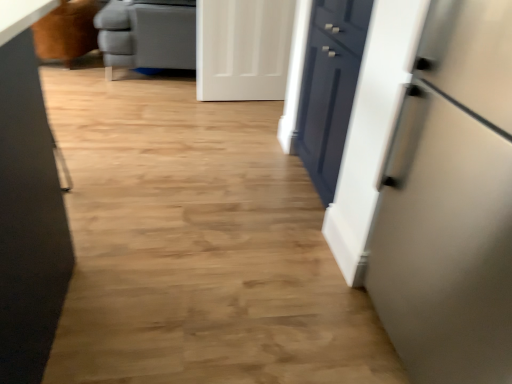
Question: Is satin white refrigerator at right wider than white matte door at upper center?

Choices:
 (A) no
 (B) yes

Answer: (B)

Question: Can we say satin white refrigerator at right lies outside white matte door at upper center?

Choices:
 (A) yes
 (B) no

Answer: (A)

Question: Are satin white refrigerator at right and white matte door at upper center beside each other?

Choices:
 (A) yes
 (B) no

Answer: (B)

Question: Does satin white refrigerator at right have a lesser height compared to white matte door at upper center?

Choices:
 (A) yes
 (B) no

Answer: (B)

Question: Would you say satin white refrigerator at right contains white matte door at upper center?

Choices:
 (A) no
 (B) yes

Answer: (A)

Question: From their relative heights in the image, would you say gray leather ottoman at upper left is taller or shorter than brown leather armchair at upper left?

Choices:
 (A) short
 (B) tall

Answer: (B)

Question: Looking at their shapes, would you say gray leather ottoman at upper left is wider or thinner than brown leather armchair at upper left?

Choices:
 (A) wide
 (B) thin

Answer: (A)

Question: From the image's perspective, is gray leather ottoman at upper left located above or below brown leather armchair at upper left?

Choices:
 (A) above
 (B) below

Answer: (A)

Question: Considering their positions, is gray leather ottoman at upper left located in front of or behind brown leather armchair at upper left?

Choices:
 (A) behind
 (B) front

Answer: (B)

Question: From their relative heights in the image, would you say satin white refrigerator at right is taller or shorter than brown leather armchair at upper left?

Choices:
 (A) tall
 (B) short

Answer: (A)

Question: Would you say satin white refrigerator at right is to the left or to the right of brown leather armchair at upper left in the picture?

Choices:
 (A) left
 (B) right

Answer: (B)

Question: In the image, is satin white refrigerator at right positioned in front of or behind brown leather armchair at upper left?

Choices:
 (A) front
 (B) behind

Answer: (A)

Question: Is satin white refrigerator at right wider or thinner than brown leather armchair at upper left?

Choices:
 (A) wide
 (B) thin

Answer: (B)

Question: Is gray leather ottoman at upper left in front of or behind satin white refrigerator at right in the image?

Choices:
 (A) behind
 (B) front

Answer: (A)

Question: From the image's perspective, is gray leather ottoman at upper left above or below satin white refrigerator at right?

Choices:
 (A) below
 (B) above

Answer: (B)